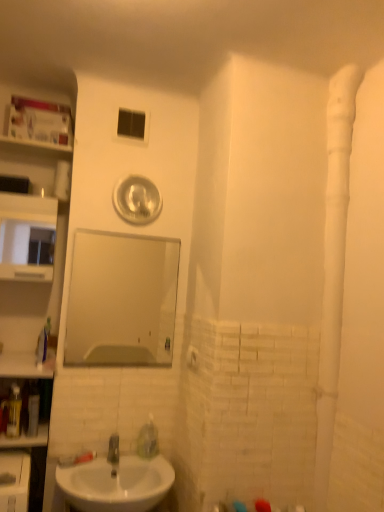
The width and height of the screenshot is (384, 512). I want to click on matte white medicine cabinet at left, so click(26, 272).

Describe the element at coordinates (26, 272) in the screenshot. I see `matte white medicine cabinet at left` at that location.

In order to face clear glass mirror at center, should I rotate leftwards or rightwards?

You should rotate left by 8.733 degrees.

Identify the location of white matte water pipe at right. (333, 264).

From a real-world perspective, does translucent plastic bottle at left sit lower than white glossy sink at lower left?

No, from a real-world perspective, translucent plastic bottle at left is not beneath white glossy sink at lower left.

Would you say translucent plastic bottle at left is outside white glossy sink at lower left?

Yes.

Is translucent plastic bottle at left not near white glossy sink at lower left?

They are positioned close to each other.

Does translucent plastic bottle at left have a lesser width compared to white glossy sink at lower left?

Yes, translucent plastic bottle at left is thinner than white glossy sink at lower left.

Looking at the image, does clear glass mirror at center seem bigger or smaller compared to matte white medicine cabinet at left?

In the image, clear glass mirror at center appears to be smaller than matte white medicine cabinet at left.

Looking at this image, is clear glass mirror at center positioned behind matte white medicine cabinet at left?

No, clear glass mirror at center is in front of matte white medicine cabinet at left.

Which is in front, point (166, 320) or point (3, 266)?

The point (3, 266) is in front.

Between white matte water pipe at right and translucent plastic bottle at left, which one appears on the left side from the viewer's perspective?

translucent plastic bottle at left is more to the left.

Relative to translucent plastic bottle at left, is white matte water pipe at right in front or behind?

white matte water pipe at right is in front of translucent plastic bottle at left.

Is white matte water pipe at right next to translucent plastic bottle at left?

No, white matte water pipe at right is not beside translucent plastic bottle at left.

In the scene shown: Is translucent plastic bottle at left inside white matte water pipe at right?

No, translucent plastic bottle at left is not a part of white matte water pipe at right.

Is translucent plastic bottle at left with transparent plastic window at upper center?

No, translucent plastic bottle at left is not touching transparent plastic window at upper center.

From a real-world perspective, who is located higher, translucent plastic bottle at left or transparent plastic window at upper center?

In real-world perspective, transparent plastic window at upper center is above.

In the scene shown: From the image's perspective, which is above, translucent plastic bottle at left or transparent plastic window at upper center?

transparent plastic window at upper center appears higher in the image.

Looking at their sizes, would you say translucent plastic bottle at left is wider or thinner than transparent plastic window at upper center?

In the image, translucent plastic bottle at left appears to be wider than transparent plastic window at upper center.

Are clear glass mirror at center and translucent plastic bottle at left beside each other?

No, clear glass mirror at center is not touching translucent plastic bottle at left.

Which object is wider, clear glass mirror at center or translucent plastic bottle at left?

Wider between the two is translucent plastic bottle at left.

This screenshot has height=512, width=384. Find the location of `mirror on the right of translucent plastic bottle at left`. mirror on the right of translucent plastic bottle at left is located at coordinates (121, 300).

Based on their sizes in the image, would you say transparent plastic window at upper center is bigger or smaller than white glossy sink at lower left?

In the image, transparent plastic window at upper center appears to be smaller than white glossy sink at lower left.

This screenshot has height=512, width=384. Identify the location of sink lying on the left of transparent plastic window at upper center. (115, 483).

Would you say transparent plastic window at upper center is to the left or to the right of white glossy sink at lower left in the picture?

From the image, it's evident that transparent plastic window at upper center is to the right of white glossy sink at lower left.

Is transparent plastic window at upper center beside white glossy sink at lower left?

No, transparent plastic window at upper center is not with white glossy sink at lower left.

Considering the sizes of white glossy sink at lower left and white matte water pipe at right in the image, is white glossy sink at lower left taller or shorter than white matte water pipe at right?

Considering their sizes, white glossy sink at lower left has less height than white matte water pipe at right.

Does white glossy sink at lower left have a larger size compared to white matte water pipe at right?

Incorrect, white glossy sink at lower left is not larger than white matte water pipe at right.

Looking at their sizes, would you say white glossy sink at lower left is wider or thinner than white matte water pipe at right?

Clearly, white glossy sink at lower left has more width compared to white matte water pipe at right.

Locate an element on the screen. water pipe that is behind the white glossy sink at lower left is located at coordinates (333, 264).

Locate an element on the screen. The height and width of the screenshot is (512, 384). sink on the right of translucent plastic bottle at left is located at coordinates (115, 483).

Identify the location of mirror in front of the matte white medicine cabinet at left. (121, 300).

Based on their spatial positions, is white glossy sink at lower left or transparent plastic window at upper center further from matte white medicine cabinet at left?

Among the two, white glossy sink at lower left is located further to matte white medicine cabinet at left.

When comparing their distances from white glossy sink at lower left, does matte white medicine cabinet at left or translucent plastic bottle at left seem further?

The object further to white glossy sink at lower left is matte white medicine cabinet at left.

From the image, which object appears to be nearer to white cardboard box at upper left, matte white medicine cabinet at left or transparent plastic window at upper center?

transparent plastic window at upper center lies closer to white cardboard box at upper left than the other object.

Estimate the real-world distances between objects in this image. Which object is closer to white cardboard box at upper left, transparent plastic window at upper center or matte white medicine cabinet at left?

transparent plastic window at upper center.

Considering their positions, is white cardboard box at upper left positioned further to transparent plastic window at upper center than matte white medicine cabinet at left?

matte white medicine cabinet at left is further to transparent plastic window at upper center.

Looking at the image, which one is located further to white matte water pipe at right, matte white medicine cabinet at left or white glossy sink at lower left?

matte white medicine cabinet at left.

Looking at the image, which one is located further to clear glass mirror at center, white matte water pipe at right or matte white medicine cabinet at left?

Among the two, white matte water pipe at right is located further to clear glass mirror at center.

When comparing their distances from white cardboard box at upper left, does matte white medicine cabinet at left or translucent plastic bottle at left seem further?

translucent plastic bottle at left lies further to white cardboard box at upper left than the other object.

Locate an element on the screen. This screenshot has width=384, height=512. water pipe between white cardboard box at upper left and white glossy sink at lower left vertically is located at coordinates (333, 264).

At what (x,y) coordinates should I click in order to perform the action: click on mirror between translucent plastic bottle at left and white matte water pipe at right in the horizontal direction. Please return your answer as a coordinate pair (x, y). Looking at the image, I should click on (121, 300).

You are a GUI agent. You are given a task and a screenshot of the screen. Output one action in this format:
    pyautogui.click(x=<x>, y=<y>)
    Task: Click on the shelf situated between matte white medicine cabinet at left and white matte water pipe at right from left to right
    
    Given the screenshot: What is the action you would take?
    pyautogui.click(x=39, y=123)

In order to click on medicine cabinet between white cardboard box at upper left and white glossy sink at lower left from top to bottom in this screenshot , I will do `click(26, 272)`.